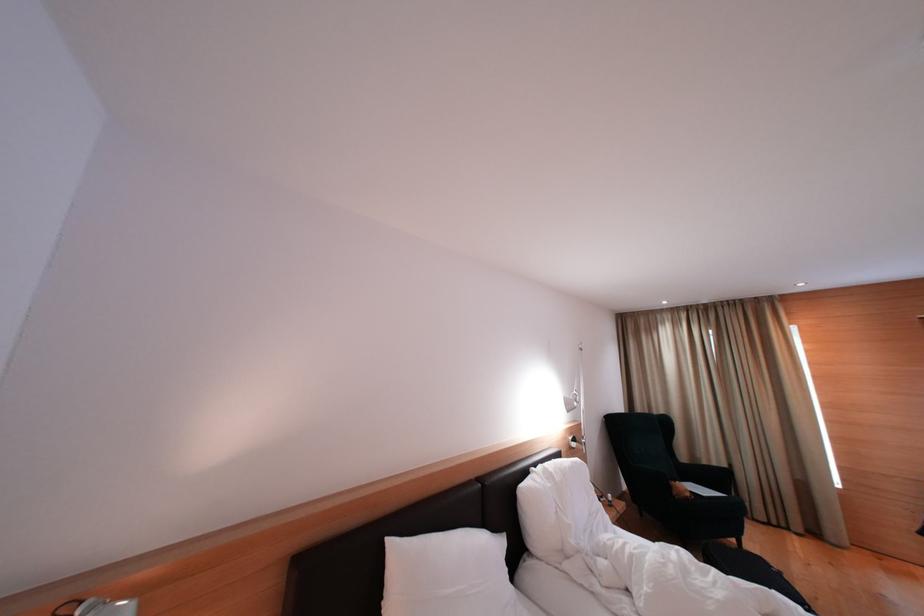
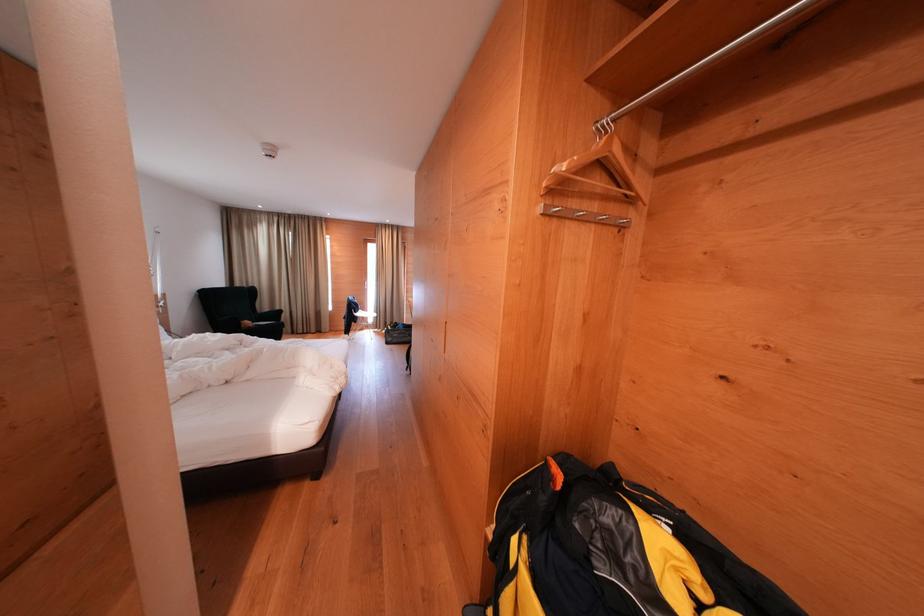
Find the pixel in the second image that matches pixel 676 492 in the first image.

(247, 329)